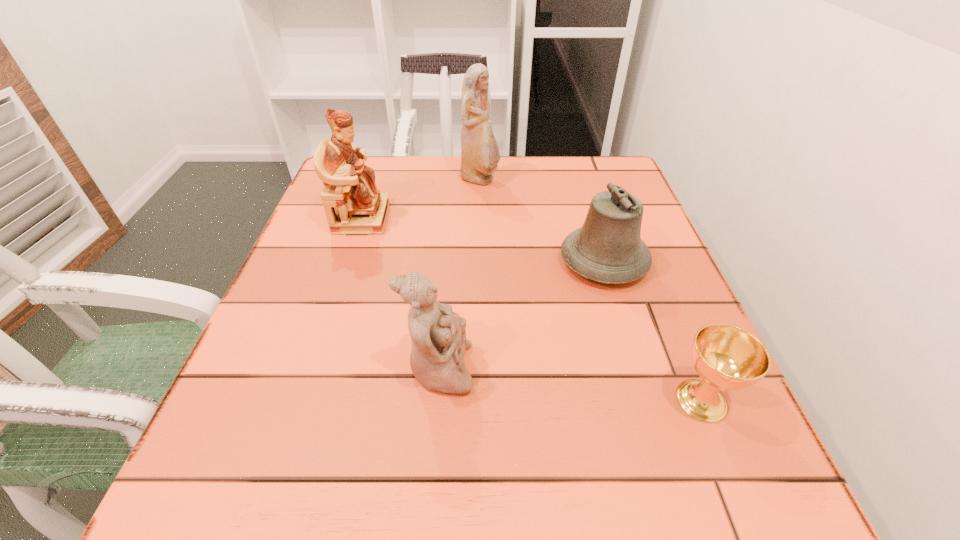
The height and width of the screenshot is (540, 960). I want to click on vacant point located between the bell and the farthest figurine, so click(541, 220).

Locate which object is the second closest to the chalice. Please provide its 2D coordinates. Your answer should be formatted as a tuple, i.e. [(x, y)], where the tuple contains the x and y coordinates of a point satisfying the conditions above.

[(438, 335)]

I want to click on the third closest object relative to the leftmost object, so click(608, 248).

Where is `the second closest figurine to the bell`? the second closest figurine to the bell is located at coordinates (438, 335).

Select which figurine appears as the second closest to the farthest figurine. Please provide its 2D coordinates. Your answer should be formatted as a tuple, i.e. [(x, y)], where the tuple contains the x and y coordinates of a point satisfying the conditions above.

[(438, 335)]

I want to click on vacant space that satisfies the following two spatial constraints: 1. on the front-facing side of the farthest object; 2. on the left side of the chalice, so click(480, 400).

At what (x,y) coordinates should I click in order to perform the action: click on free spot that satisfies the following two spatial constraints: 1. on the front-facing side of the chalice; 2. on the left side of the leftmost object. Please return your answer as a coordinate pair (x, y). Looking at the image, I should click on (301, 400).

Locate an element on the screen. Image resolution: width=960 pixels, height=540 pixels. blank area in the image that satisfies the following two spatial constraints: 1. on the front-facing side of the farthest figurine; 2. on the back side of the bell is located at coordinates (480, 261).

The height and width of the screenshot is (540, 960). I want to click on vacant space that satisfies the following two spatial constraints: 1. on the front-facing side of the bell; 2. on the right side of the leftmost object, so click(348, 261).

The image size is (960, 540). What are the coordinates of `vacant space that satisfies the following two spatial constraints: 1. on the front-facing side of the chalice; 2. on the left side of the farthest figurine` in the screenshot? It's located at (480, 400).